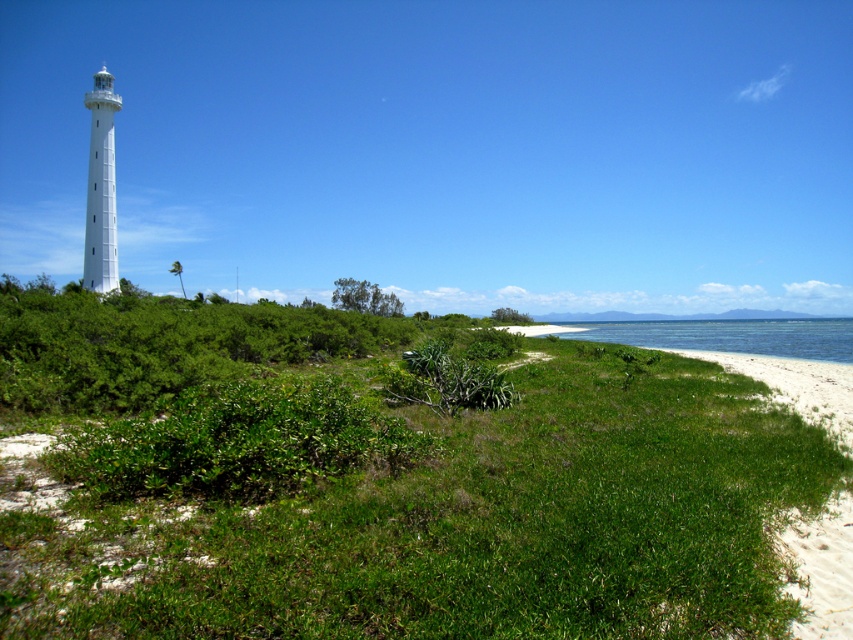
You are a photographer standing at the edge of the beach, looking towards the lighthouse. You want to take a photo that includes both the green leafy grass at center and the green leafy shrubs at center. Which of these two objects will appear closer to the camera in the photo?

The green leafy grass at center will appear closer to the camera because it is positioned in front of the green leafy shrubs at center.

You are standing at the point marked as point (463, 522) in the image. What is the terrain like under your feet?

The point (463, 522) is on green leafy grass at center, so the terrain under your feet is green leafy grass.